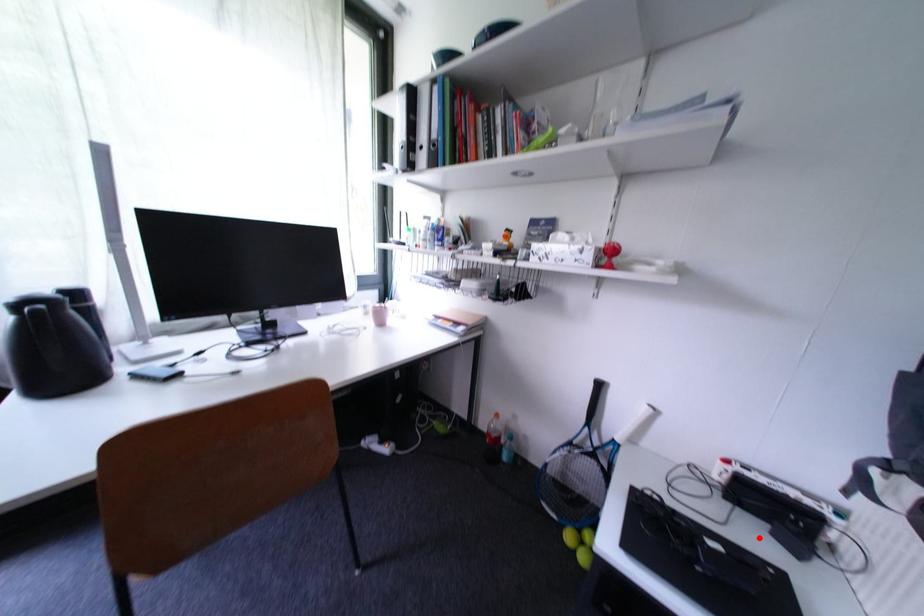
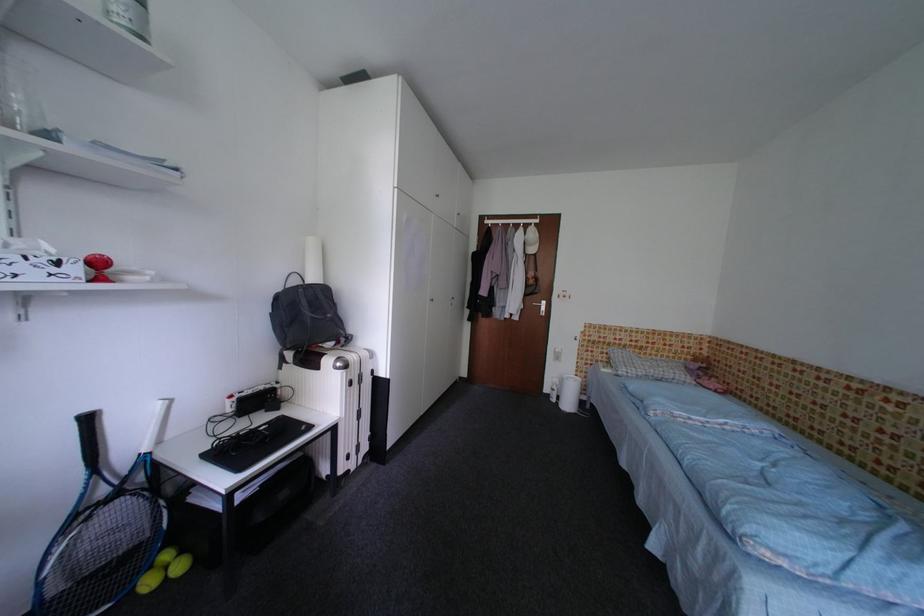
Find the pixel in the second image that matches the highlighted location in the first image.

(270, 421)